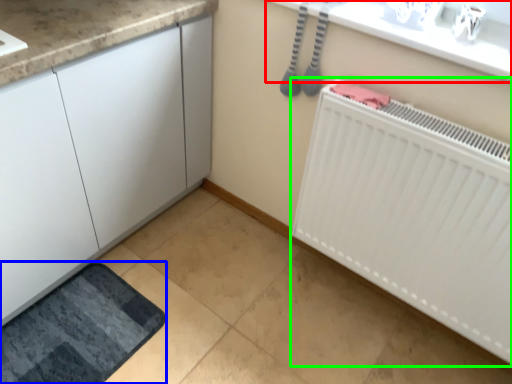
Question: Estimate the real-world distances between objects in this image. Which object is closer to counter top (highlighted by a red box), bath mat (highlighted by a blue box) or radiator (highlighted by a green box)?

Choices:
 (A) bath mat
 (B) radiator

Answer: (B)